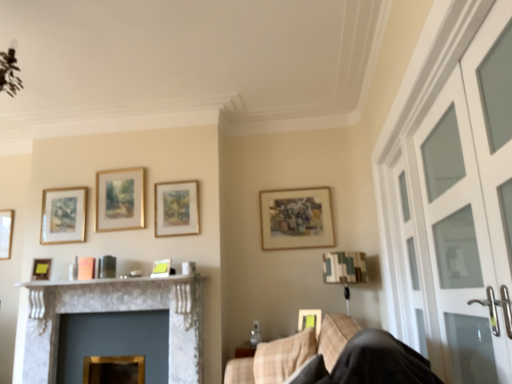
Question: Is matte gold picture frame at left, arranged as the second picture frame when viewed from the left, placed right next to matte gold picture frame at upper center, which appears as the second picture frame when viewed from the right?

Choices:
 (A) yes
 (B) no

Answer: (B)

Question: Does matte gold picture frame at left, which is the 7th picture frame in right-to-left order, have a smaller size compared to matte gold picture frame at upper center, which appears as the second picture frame when viewed from the right?

Choices:
 (A) yes
 (B) no

Answer: (A)

Question: From a real-world perspective, is matte gold picture frame at left, arranged as the second picture frame when viewed from the left, positioned over matte gold picture frame at upper center, which appears as the second picture frame when viewed from the right, based on gravity?

Choices:
 (A) yes
 (B) no

Answer: (B)

Question: Is matte gold picture frame at left, which is the 7th picture frame in right-to-left order, shorter than matte gold picture frame at upper center, which appears as the second picture frame when viewed from the right?

Choices:
 (A) no
 (B) yes

Answer: (B)

Question: Is matte gold picture frame at left, arranged as the second picture frame when viewed from the left, positioned before matte gold picture frame at upper center, the seventh picture frame positioned from the left?

Choices:
 (A) yes
 (B) no

Answer: (A)

Question: Does matte gold picture frame at left, arranged as the second picture frame when viewed from the left, have a greater width compared to matte gold picture frame at upper center, which appears as the second picture frame when viewed from the right?

Choices:
 (A) yes
 (B) no

Answer: (A)

Question: Is clear glass screen door at right, which is the first screen door from back to front, taller than matte gold picture frame at upper center, the seventh picture frame positioned from the left?

Choices:
 (A) yes
 (B) no

Answer: (A)

Question: Is clear glass screen door at right, which is the first screen door from back to front, directly adjacent to matte gold picture frame at upper center, the seventh picture frame positioned from the left?

Choices:
 (A) yes
 (B) no

Answer: (B)

Question: Does clear glass screen door at right, placed as the second screen door when sorted from front to back, appear on the left side of matte gold picture frame at upper center, the seventh picture frame positioned from the left?

Choices:
 (A) no
 (B) yes

Answer: (A)

Question: Considering the relative sizes of clear glass screen door at right, placed as the second screen door when sorted from front to back, and matte gold picture frame at upper center, the seventh picture frame positioned from the left, in the image provided, is clear glass screen door at right, placed as the second screen door when sorted from front to back, smaller than matte gold picture frame at upper center, the seventh picture frame positioned from the left,?

Choices:
 (A) no
 (B) yes

Answer: (A)

Question: From a real-world perspective, is clear glass screen door at right, placed as the second screen door when sorted from front to back, on top of matte gold picture frame at upper center, which appears as the second picture frame when viewed from the right?

Choices:
 (A) no
 (B) yes

Answer: (A)

Question: Is matte gold picture frame at upper center, which appears as the second picture frame when viewed from the right, completely or partially inside clear glass screen door at right, placed as the second screen door when sorted from front to back?

Choices:
 (A) yes
 (B) no

Answer: (B)

Question: Is matte green picture frame at center, which ranks as the first picture frame in right-to-left order, at the right side of beige fabric swivel chair at lower right?

Choices:
 (A) yes
 (B) no

Answer: (A)